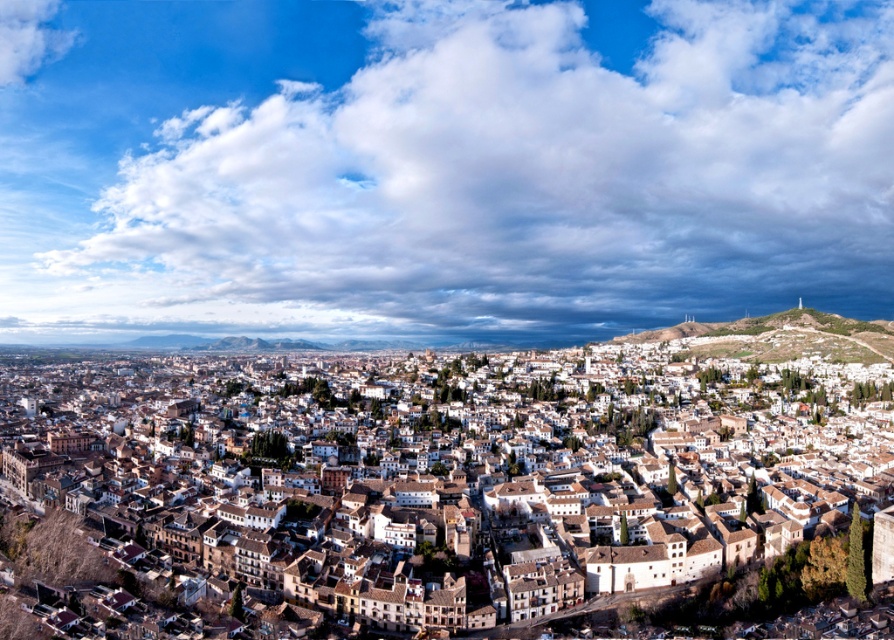
Is cloudy sky at upper center behind white textured buildings at center?

That is True.

Who is shorter, cloudy sky at upper center or white textured buildings at center?

white textured buildings at center is shorter.

At what (x,y) coordinates should I click in order to perform the action: click on cloudy sky at upper center. Please return your answer as a coordinate pair (x, y). Image resolution: width=894 pixels, height=640 pixels. Looking at the image, I should click on (445, 170).

Can you confirm if white textured buildings at center is positioned to the right of white fluffy cloud at upper left?

Correct, you'll find white textured buildings at center to the right of white fluffy cloud at upper left.

Which is more to the left, white textured buildings at center or white fluffy cloud at upper left?

From the viewer's perspective, white fluffy cloud at upper left appears more on the left side.

Which is in front, point (106, 532) or point (47, 8)?

Point (106, 532) is more forward.

Locate an element on the screen. This screenshot has height=640, width=894. white textured buildings at center is located at coordinates (458, 474).

Can you confirm if cloudy sky at upper center is wider than white fluffy cloud at upper left?

Yes, cloudy sky at upper center is wider than white fluffy cloud at upper left.

Locate an element on the screen. cloudy sky at upper center is located at coordinates (445, 170).